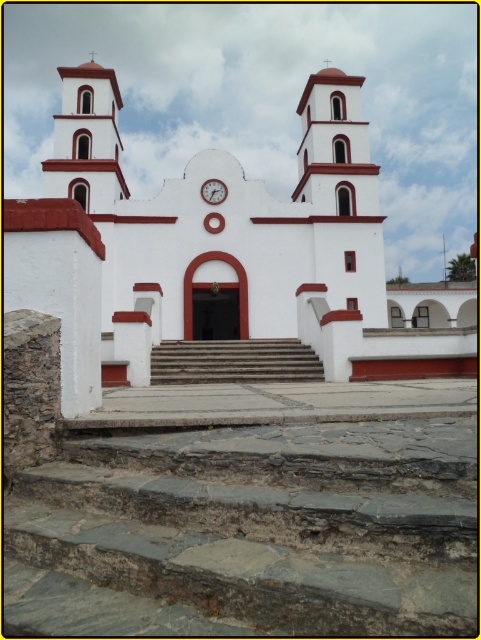
Question: Which of the following is the farthest from the observer?

Choices:
 (A) (282, 502)
 (B) (295, 369)

Answer: (B)

Question: Can you confirm if white matte church at center is wider than smooth stone stairs at center?

Choices:
 (A) yes
 (B) no

Answer: (A)

Question: Which point is farther to the camera?

Choices:
 (A) smooth stone stairs at center
 (B) gray stone stairs at center
 (C) white stucco spire at upper left

Answer: (C)

Question: Among these objects, which one is farthest from the camera?

Choices:
 (A) white matte church at center
 (B) white matte clock at center
 (C) smooth stone stairs at center

Answer: (B)

Question: Can you confirm if white stucco spire at upper left is positioned above white matte clock at center?

Choices:
 (A) yes
 (B) no

Answer: (A)

Question: Is white matte church at center above gray stone stairs at center?

Choices:
 (A) no
 (B) yes

Answer: (B)